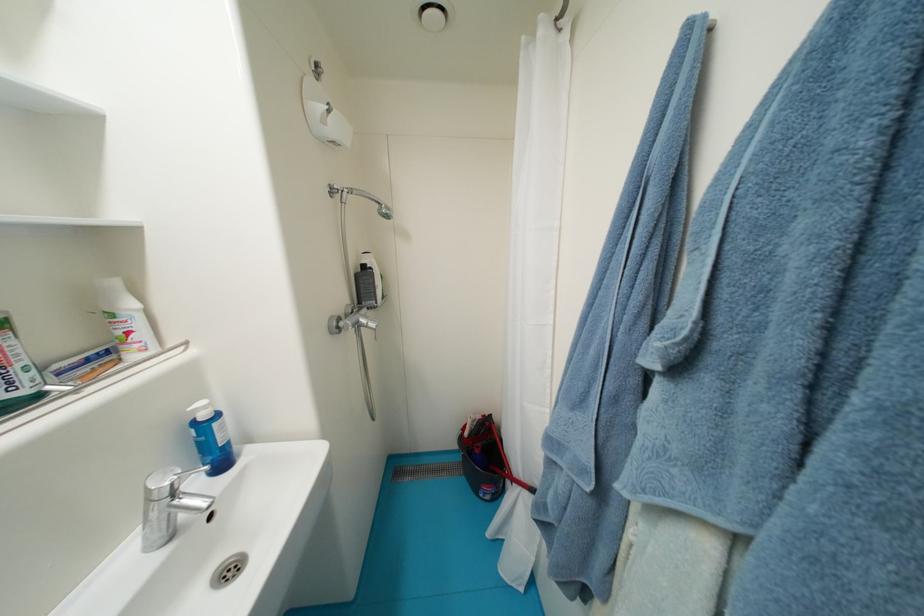
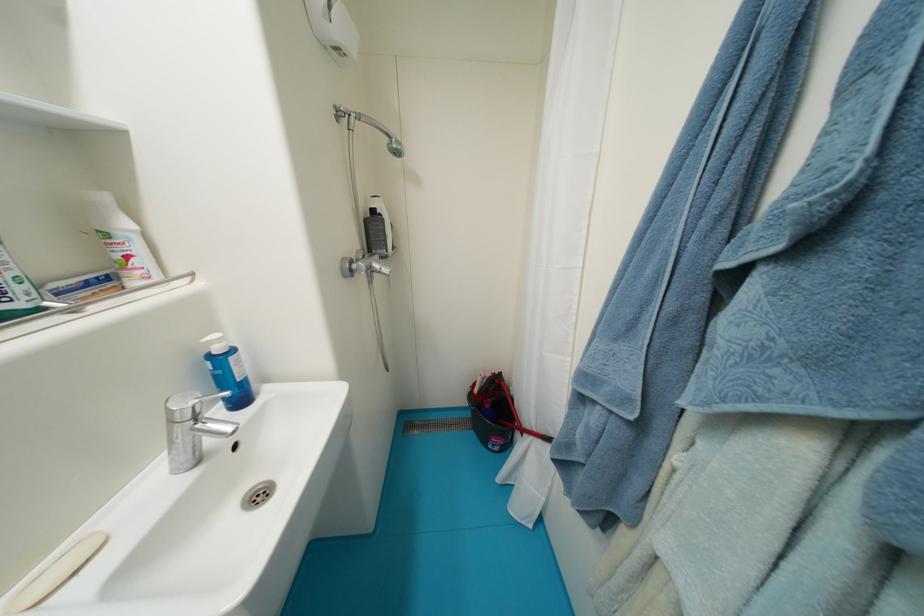
The point at (371, 269) is marked in the first image. Where is the corresponding point in the second image?

(380, 214)